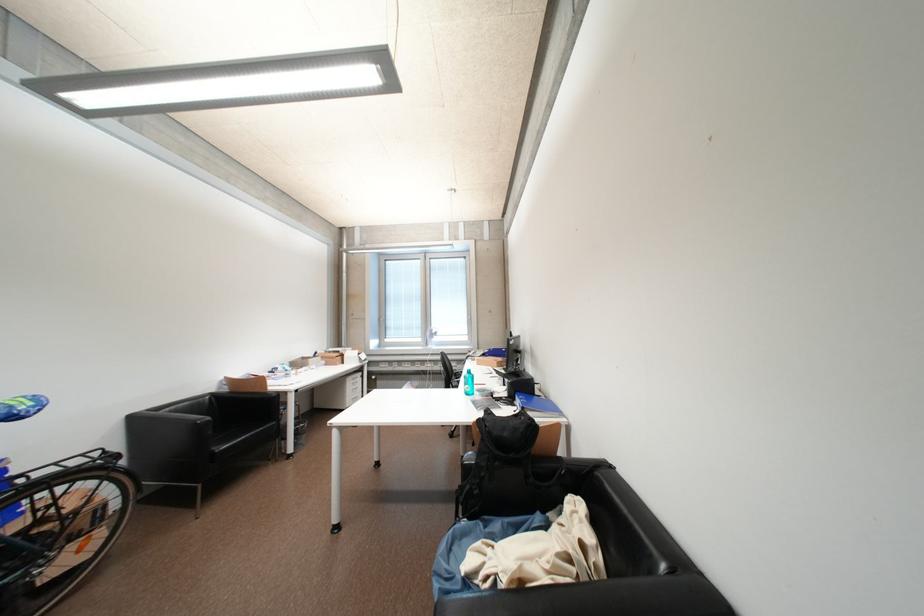
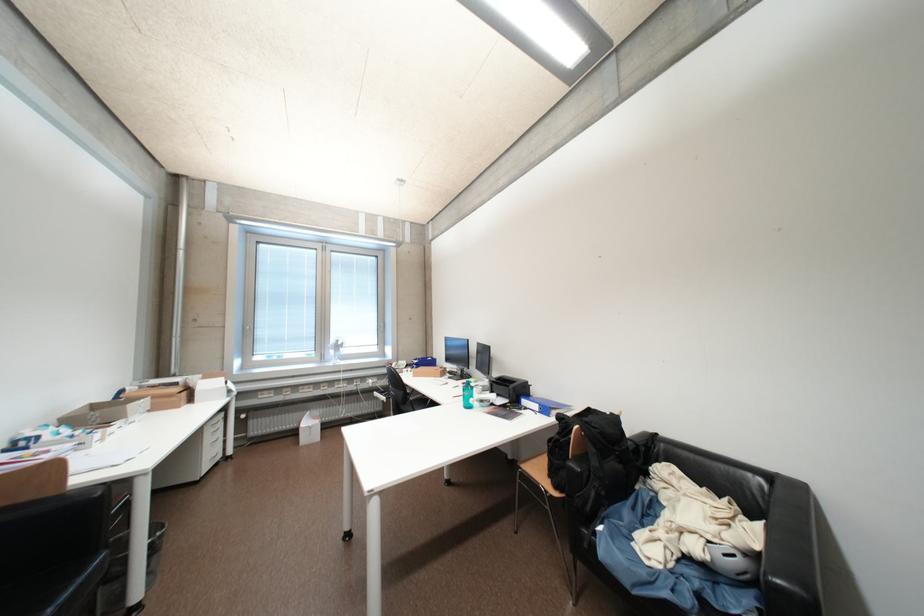
Find the pixel in the second image that matches (x=358, y=384) in the first image.

(216, 432)